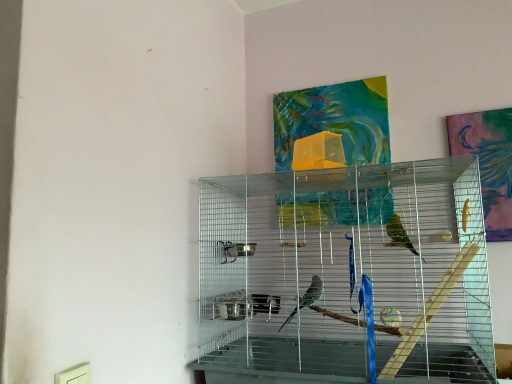
In order to face metal wire cage at center, should I rotate leftwards or rightwards?

Rotate your view right by about 10.500°.

What do you see at coordinates (345, 274) in the screenshot?
I see `metal wire cage at center` at bounding box center [345, 274].

I want to click on metal wire cage at center, so click(345, 274).

At what (x,y) coordinates should I click in order to perform the action: click on metal wire cage at center. Please return your answer as a coordinate pair (x, y). The height and width of the screenshot is (384, 512). Looking at the image, I should click on pos(345,274).